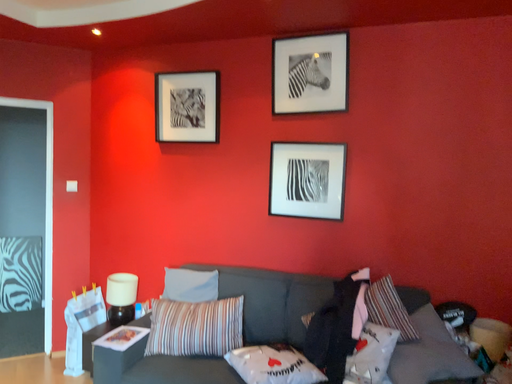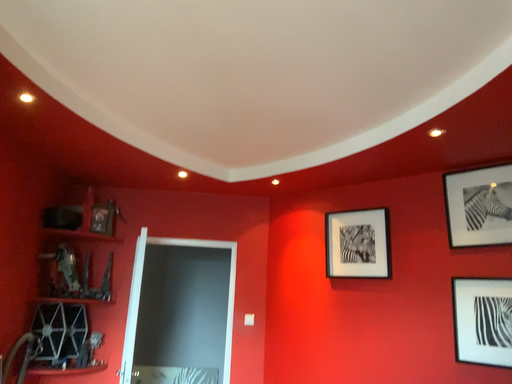
Question: How did the camera likely rotate when shooting the video?

Choices:
 (A) rotated upward
 (B) rotated downward

Answer: (A)